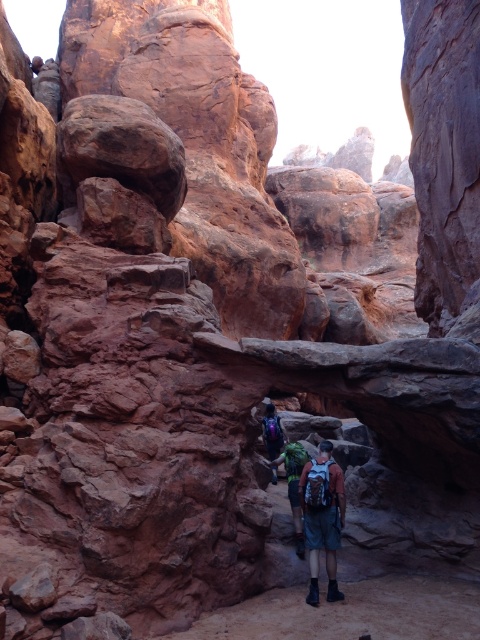
You are a hiker standing at the entrance of the canyon. You see the point marked as point [323,516]. What object is located at that point?

The point [323,516] corresponds to the matte blue shorts at center.

You are a hiker planning to cross the canyon and need to place a 0.5 meter wide tent. There is a point marked at coordinates (323,516) where matte blue shorts at center are located. Can you safely place your tent there without overlapping the shorts?

The point at (323,516) has matte blue shorts at center. Since the tent is 0.5 meters wide, it might overlap with the shorts if placed there. Check the exact dimensions and spacing before deciding.

Based on the photo, you are a hiker planning to move from your current position to the edge of the canyon. You notice the matte blue shorts at center and the matte purple backpack at center in your path. Considering the narrow canyon, will the 15.35 meters between them allow you to pass safely without needing to backtrack?

The distance of 15.35 meters between the matte blue shorts at center and the matte purple backpack at center is sufficient for safe passage through the narrow canyon, so you can proceed without needing to backtrack.